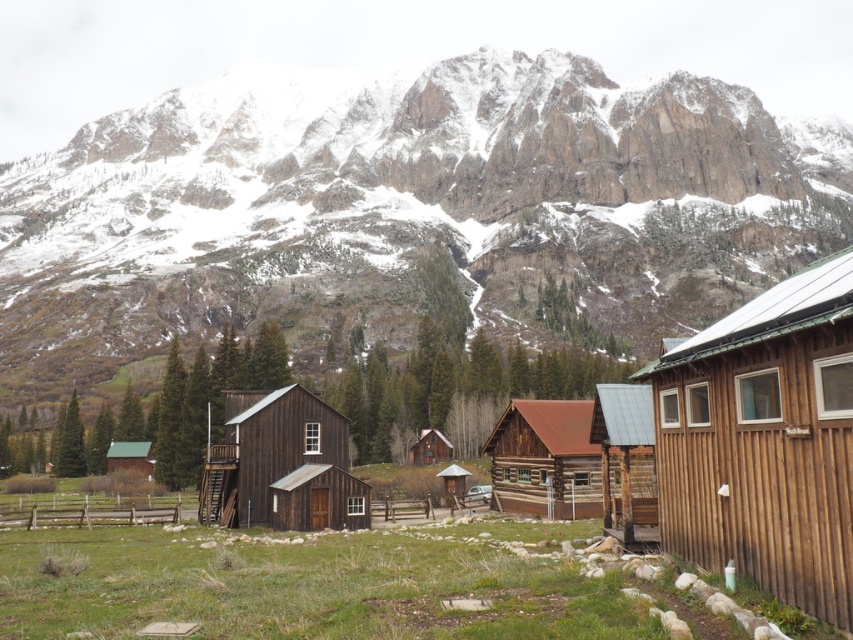
You are standing at the center of the image and want to locate the brown wooden cabin at right. According to the coordinate system where the bottom left corner is the origin, can you determine its position?

The brown wooden cabin at right is located at the 2D coordinate point of (764, 442).

You are planning to host a small gathering and need to choose between the green shingled cabin at lower left and the brown wooden cabin at center for more guests. Which cabin can accommodate more people based on their sizes?

The green shingled cabin at lower left has a larger width than the brown wooden cabin at center, so it can accommodate more people.